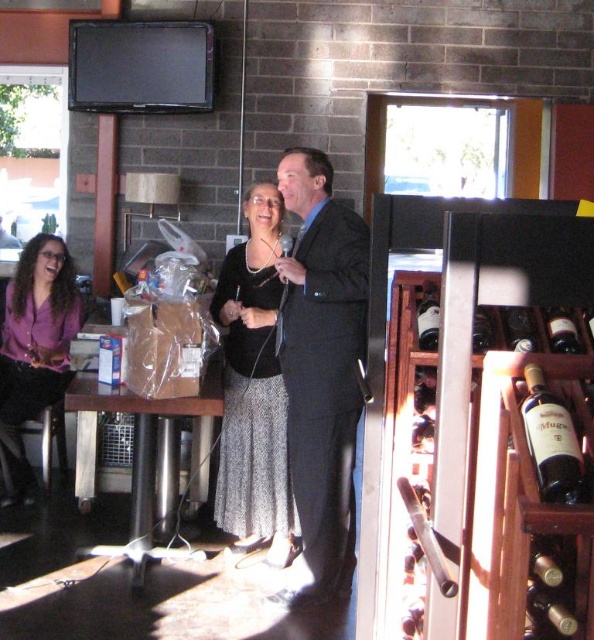
Where is `dark red glass bottle at center`? The width and height of the screenshot is (594, 640). dark red glass bottle at center is located at coordinates (551, 442).

Does point (548, 403) come farther from viewer compared to point (435, 292)?

No, it is not.

The image size is (594, 640). Find the location of `dark red glass bottle at center`. dark red glass bottle at center is located at coordinates (551, 442).

Is dark brown glass bottle at center right smaller than translucent glass wine bottle at center right?

Incorrect, dark brown glass bottle at center right is not smaller in size than translucent glass wine bottle at center right.

Which is behind, point (419, 346) or point (513, 349)?

The point (419, 346) is more distant.

Between point (426, 340) and point (513, 317), which one is positioned behind?

The point (426, 340) is behind.

Locate an element on the screen. Image resolution: width=594 pixels, height=640 pixels. dark brown glass bottle at center right is located at coordinates (428, 317).

Is wooden wine rack at right closer to camera compared to silver metallic skirt at center?

Yes, it is in front of silver metallic skirt at center.

Locate an element on the screen. This screenshot has width=594, height=640. wooden wine rack at right is located at coordinates (485, 422).